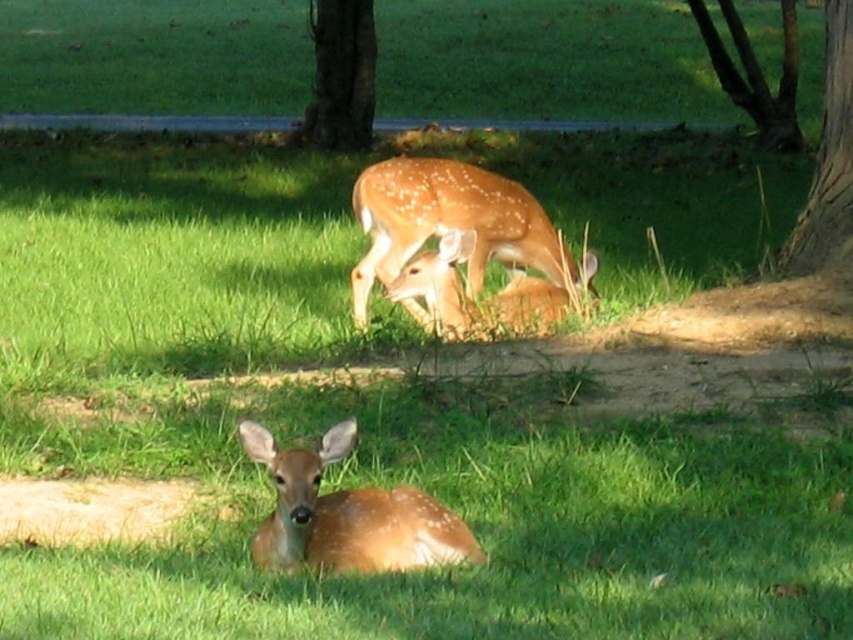
Question: Which is farther from the spotted fur deer at center?

Choices:
 (A) smooth bark tree trunk at right
 (B) spotted brown deer at lower center
 (C) brown rough bark tree at upper center
 (D) brown rough tree at upper center

Answer: (C)

Question: Is spotted brown deer at lower center smaller than brown rough bark tree at upper center?

Choices:
 (A) yes
 (B) no

Answer: (B)

Question: Does spotted fur deer at center appear on the right side of brown rough tree at upper center?

Choices:
 (A) no
 (B) yes

Answer: (B)

Question: Which of these objects is positioned closest to the brown rough bark tree at upper center?

Choices:
 (A) spotted brown deer at lower center
 (B) spotted fur deer at center
 (C) smooth bark tree trunk at right
 (D) brown rough tree at upper center

Answer: (D)

Question: Can you confirm if brown rough tree at upper center is thinner than brown rough bark tree at upper center?

Choices:
 (A) yes
 (B) no

Answer: (B)

Question: Which point is farther to the camera?

Choices:
 (A) (289, 460)
 (B) (796, 259)

Answer: (B)